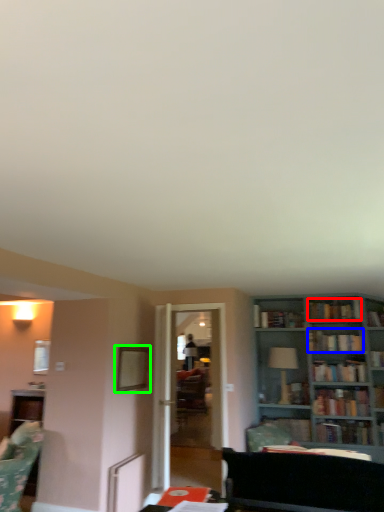
Question: Which object is positioned farthest from book (highlighted by a red box)? Select from book (highlighted by a blue box) and picture frame (highlighted by a green box).

Choices:
 (A) book
 (B) picture frame

Answer: (B)